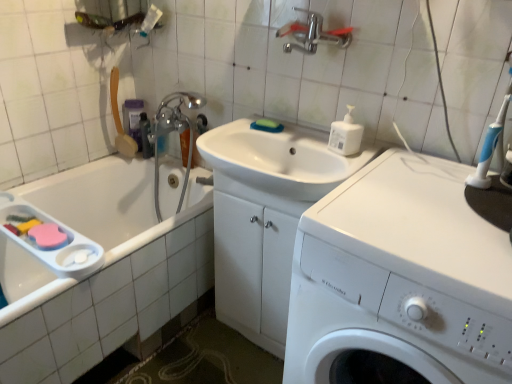
Question: Is green sponge at sink in contact with white plastic washing machine at center?

Choices:
 (A) no
 (B) yes

Answer: (A)

Question: Is green sponge at sink taller than white plastic washing machine at center?

Choices:
 (A) yes
 (B) no

Answer: (B)

Question: From a real-world perspective, is green sponge at sink physically below white plastic washing machine at center?

Choices:
 (A) yes
 (B) no

Answer: (B)

Question: Does green sponge at sink have a smaller size compared to white plastic washing machine at center?

Choices:
 (A) yes
 (B) no

Answer: (A)

Question: Is green sponge at sink turned away from white plastic washing machine at center?

Choices:
 (A) no
 (B) yes

Answer: (A)

Question: From the image's perspective, relative to white glossy sink at center, is white plastic bottle at upper right above or below?

Choices:
 (A) below
 (B) above

Answer: (B)

Question: Visually, is white plastic bottle at upper right positioned to the left or to the right of white glossy sink at center?

Choices:
 (A) left
 (B) right

Answer: (B)

Question: Is white plastic bottle at upper right wider or thinner than white glossy sink at center?

Choices:
 (A) thin
 (B) wide

Answer: (A)

Question: Considering their positions, is white plastic bottle at upper right located in front of or behind white glossy sink at center?

Choices:
 (A) front
 (B) behind

Answer: (B)

Question: Based on their sizes in the image, would you say green sponge at sink is bigger or smaller than translucent plastic bottle at upper left, the 1th toiletry positioned from the right?

Choices:
 (A) big
 (B) small

Answer: (B)

Question: From their relative heights in the image, would you say green sponge at sink is taller or shorter than translucent plastic bottle at upper left, the 1th toiletry positioned from the right?

Choices:
 (A) short
 (B) tall

Answer: (A)

Question: From a real-world perspective, is green sponge at sink above or below translucent plastic bottle at upper left, the 2th toiletry positioned from the left?

Choices:
 (A) above
 (B) below

Answer: (A)

Question: From the image's perspective, is green sponge at sink positioned above or below translucent plastic bottle at upper left, the 1th toiletry positioned from the right?

Choices:
 (A) below
 (B) above

Answer: (A)

Question: From a real-world perspective, is white plastic washing machine at center positioned above or below green sponge at sink?

Choices:
 (A) below
 (B) above

Answer: (A)

Question: From the image's perspective, is white plastic washing machine at center located above or below green sponge at sink?

Choices:
 (A) below
 (B) above

Answer: (A)